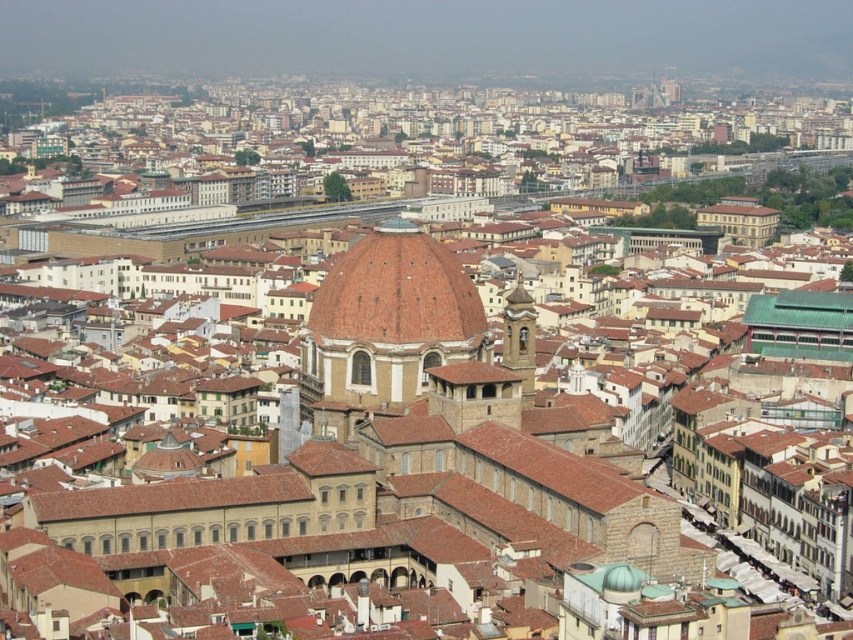
From the picture: You are a drone operator tasked with capturing aerial footage of the city. Your drone is currently at point A, which is located at coordinates 0.3, 0.3. You need to fly to the brown matte dome at center to get a close shot. Which direction should you fly to reach the dome from your current position?

The brown matte dome at center is located at coordinates [397,291]. Since your current position is at [254,192], you should fly northeast to reach the dome.